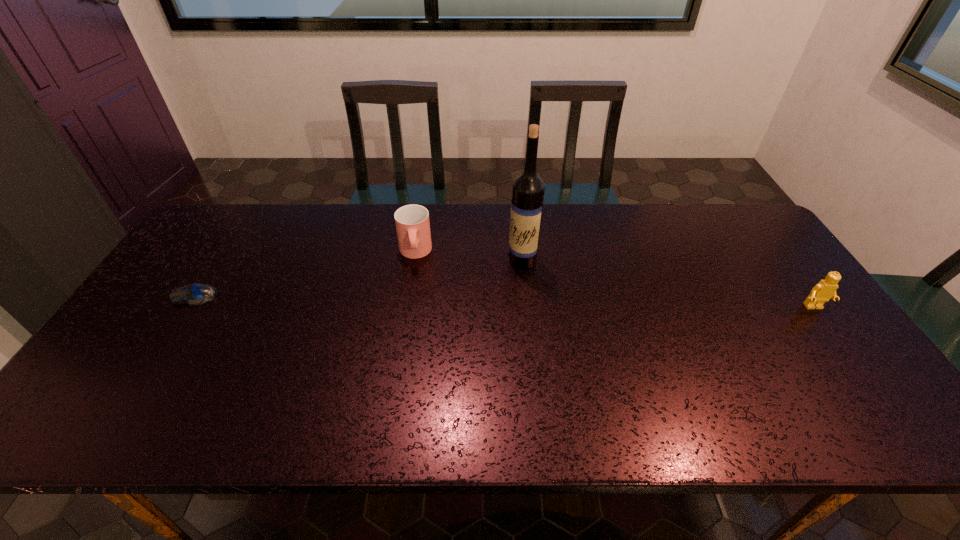
You are a GUI agent. You are given a task and a screenshot of the screen. Output one action in this format:
    pyautogui.click(x=<x>, y=<y>)
    Task: Click on the free point between the second object from right to left and the second object from left to right
    
    Given the screenshot: What is the action you would take?
    pyautogui.click(x=468, y=256)

I want to click on vacant point located between the third object from left to right and the cup, so click(x=468, y=256).

This screenshot has height=540, width=960. I want to click on blank region between the wine bottle and the Lego, so click(668, 284).

Identify the location of free space that is in between the leftmost object and the second object from left to right. (305, 274).

Identify the location of free point between the third object from left to right and the rightmost object. (668, 284).

I want to click on empty location between the cup and the tallest object, so click(468, 256).

This screenshot has width=960, height=540. I want to click on vacant point located between the leftmost object and the second object from left to right, so click(x=305, y=274).

In order to click on free area in between the Lego and the leftmost object in this screenshot , I will do `click(505, 301)`.

Where is `free space between the second object from right to left and the shortest object`? free space between the second object from right to left and the shortest object is located at coordinates (359, 278).

Where is `free area in between the computer mouse and the Lego`? free area in between the computer mouse and the Lego is located at coordinates (505, 301).